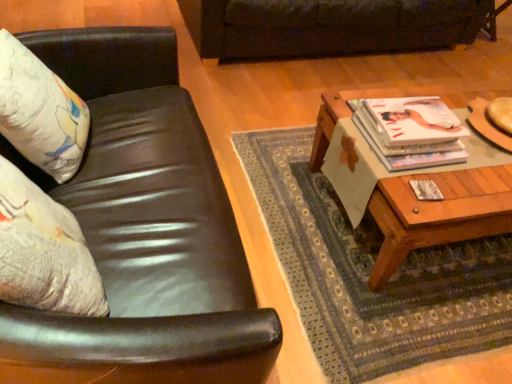
Question: Is white glossy magazine at upper right oriented away from woodenwoodencoffee table at right?

Choices:
 (A) no
 (B) yes

Answer: (A)

Question: From a real-world perspective, is white glossy magazine at upper right located beneath woodenwoodencoffee table at right?

Choices:
 (A) yes
 (B) no

Answer: (B)

Question: Is woodenwoodencoffee table at right inside white glossy magazine at upper right?

Choices:
 (A) no
 (B) yes

Answer: (A)

Question: Considering the relative sizes of white glossy magazine at upper right and woodenwoodencoffee table at right in the image provided, is white glossy magazine at upper right thinner than woodenwoodencoffee table at right?

Choices:
 (A) no
 (B) yes

Answer: (B)

Question: Is the surface of white glossy magazine at upper right in direct contact with woodenwoodencoffee table at right?

Choices:
 (A) no
 (B) yes

Answer: (A)

Question: Is white glossy magazine at upper right at the right side of woodenwoodencoffee table at right?

Choices:
 (A) no
 (B) yes

Answer: (A)

Question: Is woodenwoodencoffee table at right positioned behind white glossy magazine at upper right?

Choices:
 (A) no
 (B) yes

Answer: (A)

Question: Can you confirm if woodenwoodencoffee table at right is shorter than white glossy magazine at upper right?

Choices:
 (A) no
 (B) yes

Answer: (A)

Question: Is woodenwoodencoffee table at right thinner than white glossy magazine at upper right?

Choices:
 (A) no
 (B) yes

Answer: (A)

Question: Can you confirm if woodenwoodencoffee table at right is smaller than white glossy magazine at upper right?

Choices:
 (A) no
 (B) yes

Answer: (A)

Question: Are woodenwoodencoffee table at right and white glossy magazine at upper right making contact?

Choices:
 (A) yes
 (B) no

Answer: (B)

Question: Is woodenwoodencoffee table at right located outside white glossy magazine at upper right?

Choices:
 (A) no
 (B) yes

Answer: (B)

Question: Is matte white pillow at left further to the viewer compared to white glossy magazine at upper right?

Choices:
 (A) yes
 (B) no

Answer: (B)